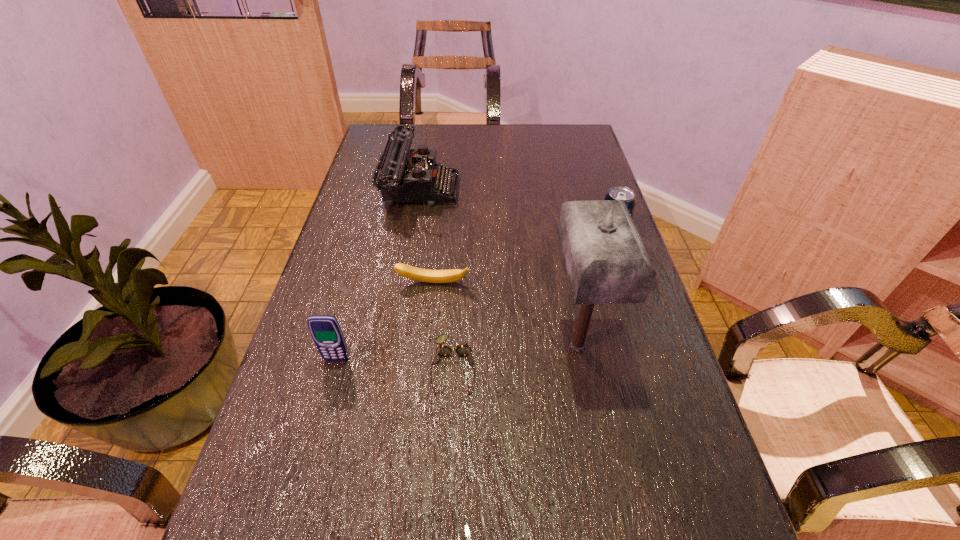
Where is `free space located on the keyboard of the farthest object`? free space located on the keyboard of the farthest object is located at coordinates (501, 188).

What are the coordinates of `free region located on the left of the soda can` in the screenshot? It's located at (468, 237).

Find the location of a particular element. The height and width of the screenshot is (540, 960). blank space located 0.180m on the front-facing side of the cellular telephone is located at coordinates (312, 449).

The height and width of the screenshot is (540, 960). In order to click on blank space located at the stem of the fifth tallest object in this screenshot , I will do `click(428, 333)`.

Find the location of a particular element. The width and height of the screenshot is (960, 540). free space located on the front-facing side of the shortest object is located at coordinates (448, 476).

Where is `typewriter situated at the left edge`? typewriter situated at the left edge is located at coordinates (401, 176).

Where is `cellular telephone present at the left edge`? The height and width of the screenshot is (540, 960). cellular telephone present at the left edge is located at coordinates (325, 330).

This screenshot has height=540, width=960. I want to click on mallet located at the right edge, so click(x=606, y=261).

Identify the location of soda can that is at the right edge. (622, 193).

Identify the location of vacant area at the far edge. Image resolution: width=960 pixels, height=540 pixels. (447, 134).